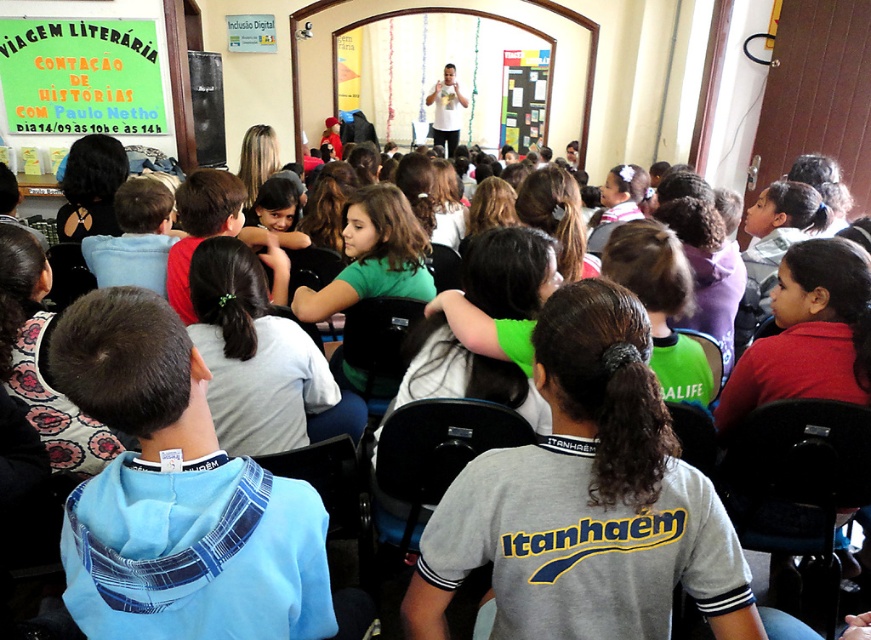
You are a teacher preparing to hang a new sign in the classroom. You have the green paperboard sign at upper left and the matte white shirt at center. Which object is larger in size?

The green paperboard sign at upper left is bigger than the matte white shirt at center.

You are a visitor entering the room and want to locate the speaker who is standing behind the green paperboard sign at upper left. Which direction should you turn to face the speaker from your current position facing the matte white shirt at center?

You should turn to your left to face the speaker behind the green paperboard sign at upper left, since the green paperboard sign at upper left is to the left of matte white shirt at center.